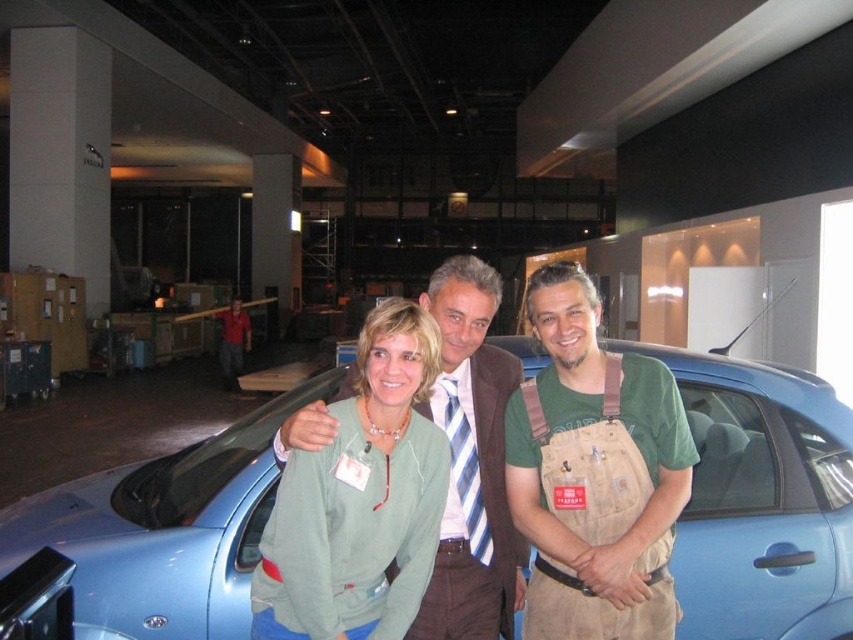
Is the position of green canvas overalls at center more distant than that of green cotton hoodie at center?

No, it is in front of green cotton hoodie at center.

Which of these two, green canvas overalls at center or green cotton hoodie at center, stands shorter?

Standing shorter between the two is green canvas overalls at center.

Is point (641, 477) positioned in front of point (527, 528)?

Yes, point (641, 477) is in front of point (527, 528).

This screenshot has width=853, height=640. Identify the location of green canvas overalls at center. (595, 474).

Looking at this image, who is lower down, blue matte car at center or green canvas overalls at center?

blue matte car at center

How much distance is there between blue matte car at center and green canvas overalls at center?

blue matte car at center and green canvas overalls at center are 1.23 meters apart.

Image resolution: width=853 pixels, height=640 pixels. Identify the location of blue matte car at center. (762, 500).

This screenshot has height=640, width=853. Identify the location of blue matte car at center. (762, 500).

Which of these two, green cotton hoodie at center or green fabric jacket at center, stands taller?

green cotton hoodie at center is taller.

Is green cotton hoodie at center above green fabric jacket at center?

Yes.

This screenshot has width=853, height=640. I want to click on green cotton hoodie at center, so click(x=529, y=467).

The height and width of the screenshot is (640, 853). I want to click on green cotton hoodie at center, so click(x=529, y=467).